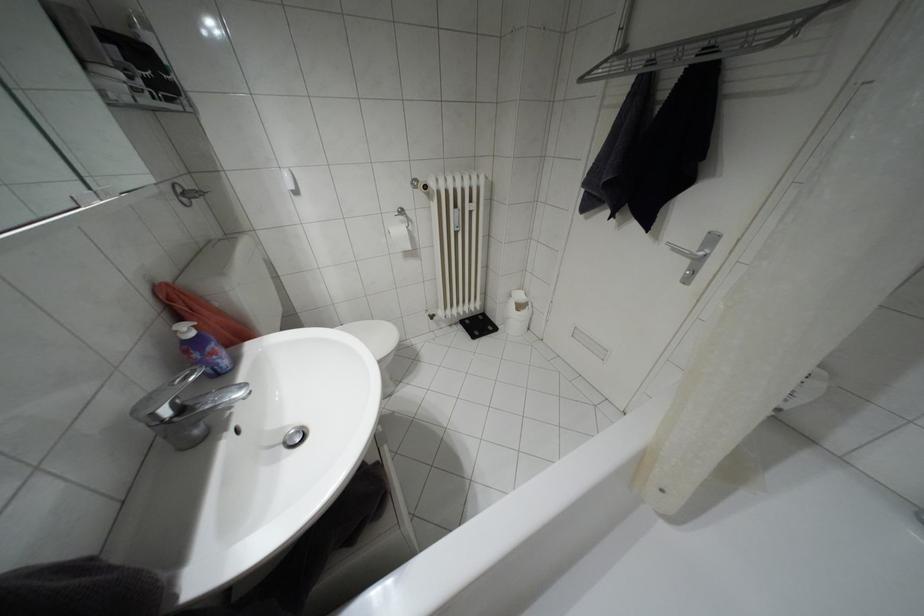
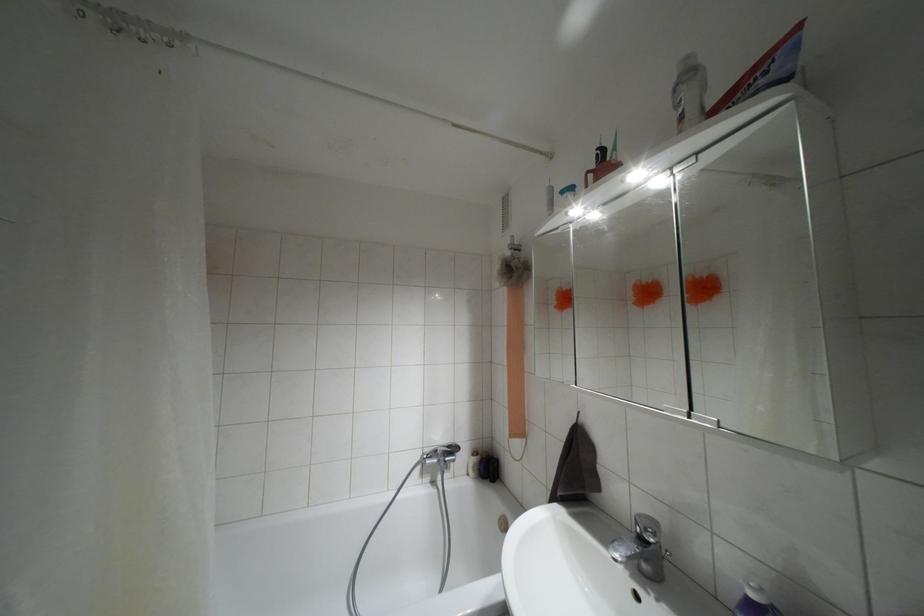
Where in the second image is the point corresponding to point (190, 333) from the first image?

(751, 594)